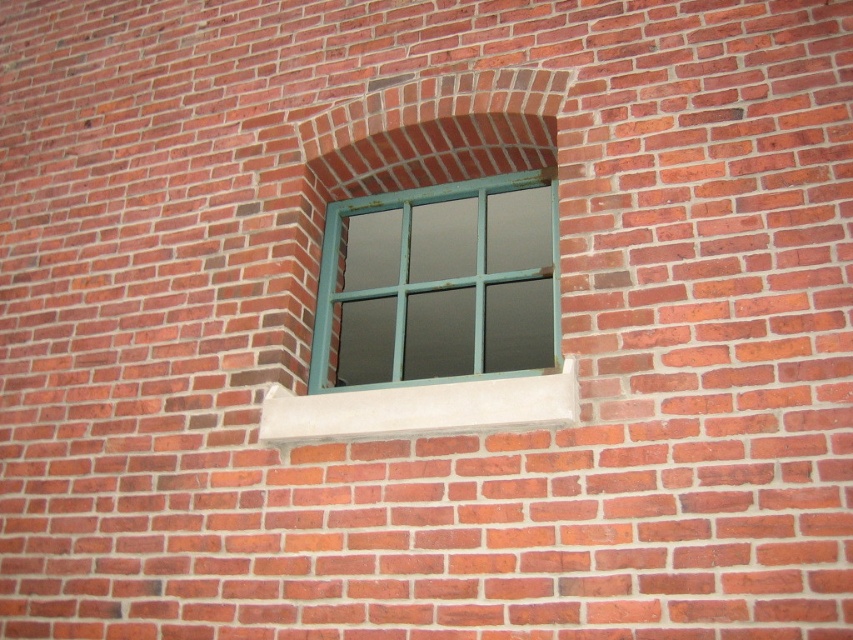
You are standing in front of a brick wall with a green painted wood window at center. If you want to take a photo of the window using a camera that requires a minimum distance of 2 meters to focus properly, will you be able to focus on the window from your current position?

The distance between you and the green painted wood window at center is 2.61 meters, which is more than the required 2 meters. Therefore, you can focus on the window from your current position.

You are a painter assessing the wall for a new project. You notice the green painted wood window at center and the white concrete at center. Which object would require more paint if you were to cover their entire surfaces?

The green painted wood window at center is bigger than the white concrete at center, so it would require more paint to cover its entire surface.

You are standing in front of the brick wall with the window and want to touch both points mentioned. Which point will you reach first, point (525, 113) or point (519, 419)?

Point (525, 113) is further to the viewer than point (519, 419), so you will reach point (525, 113) first.